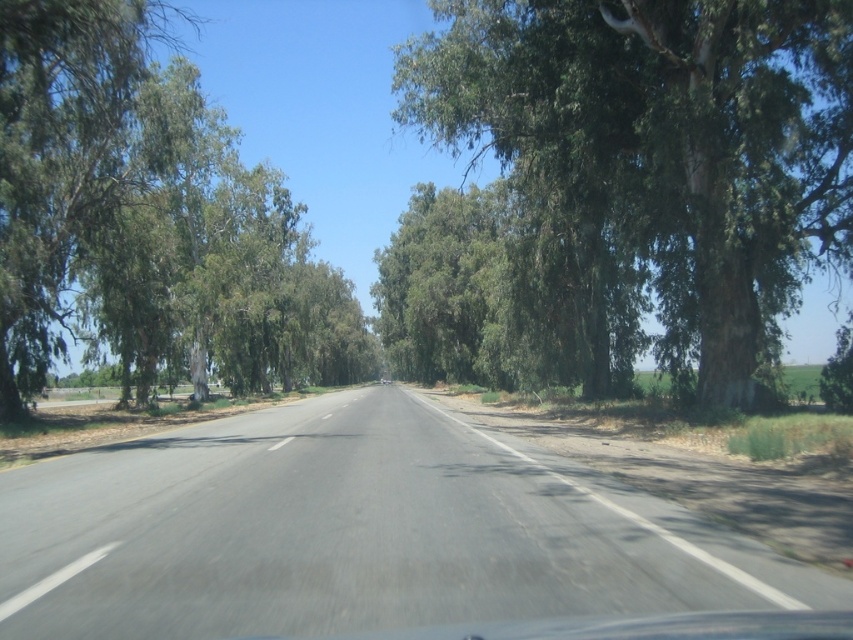
You are a self driving car and you want to stay in your current lane. Where should you position your vehicle relative to the asphalt road at center?

The asphalt road at center is located at point (355, 532), so the vehicle should position itself along the center line of the asphalt road at center to stay in its current lane.

You are driving a car and see the asphalt road at center and the green leafy tree at left. Which one is closer to the right side of your vehicle?

The asphalt road at center is positioned on the right side of green leafy tree at left, so the asphalt road at center is closer to the right side of your vehicle.

You are driving along the two lane road and notice two points marked on the road ahead. The first point is at coordinate point (456, 456) and the second at point (567, 10). Which point is closer to your vehicle?

Point (456, 456) is closer to the camera than point (567, 10), so the first point is closer to your vehicle.